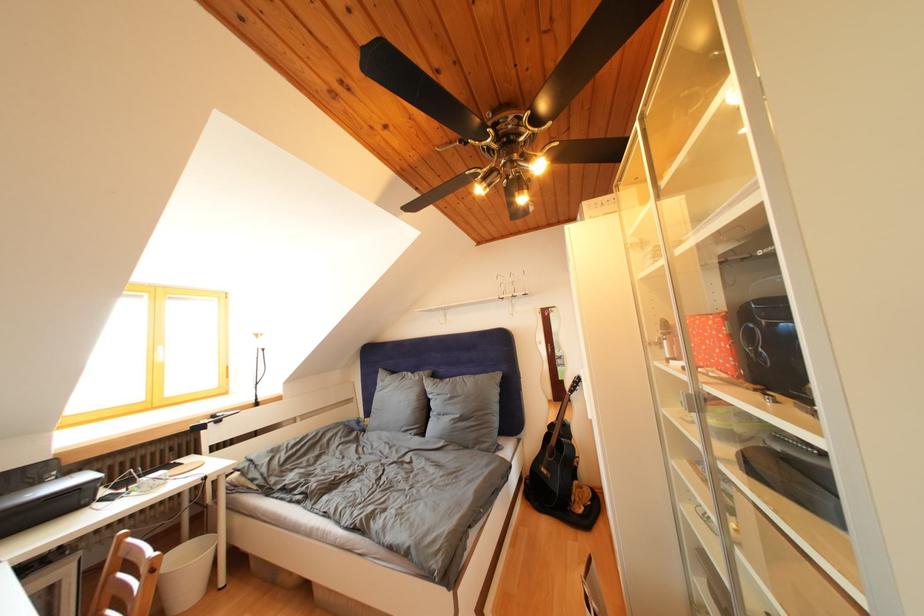
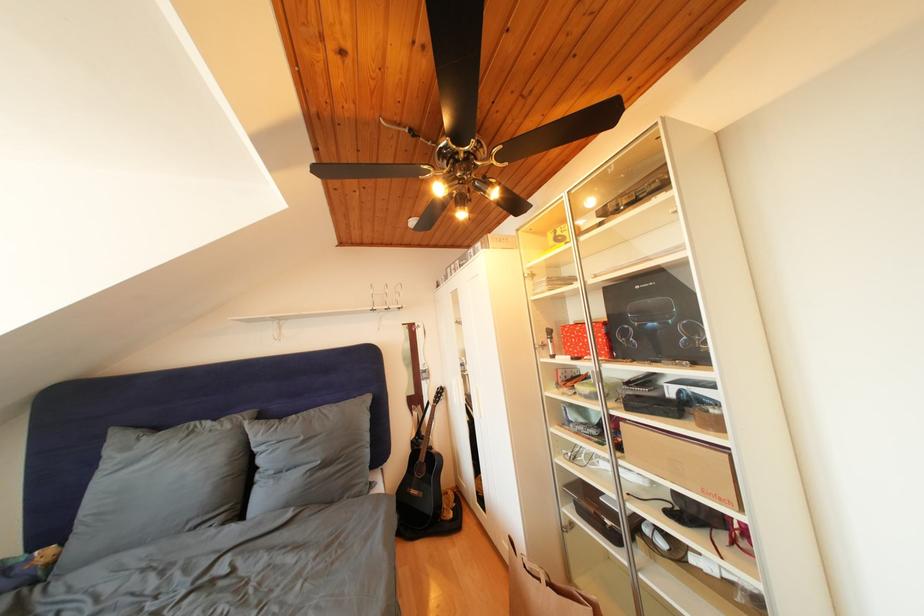
In the second image, find the point that corresponds to point 426,383 in the first image.

(236, 432)